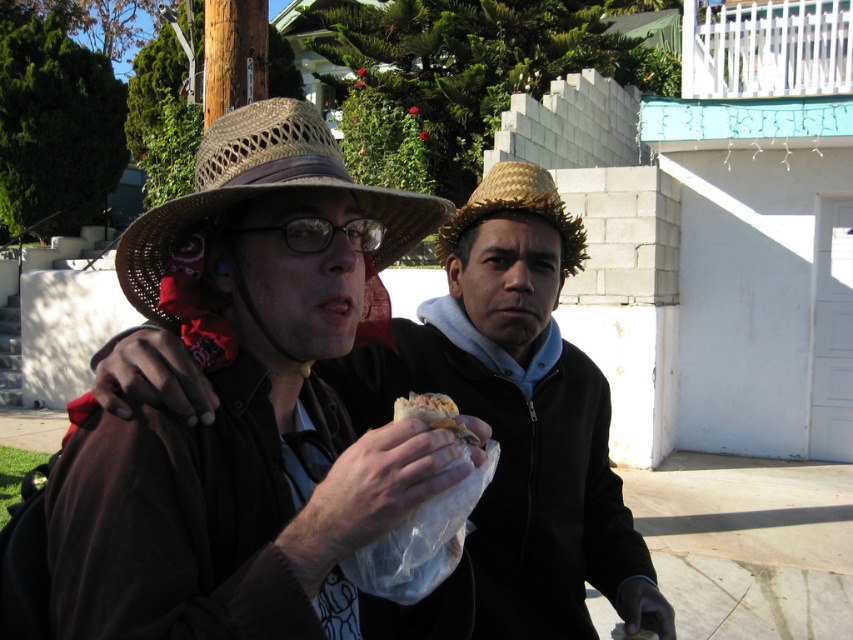
Question: Is woven straw hat at center positioned in front of shiny plastic wrap at center?

Choices:
 (A) no
 (B) yes

Answer: (A)

Question: Which object is farther from the camera taking this photo?

Choices:
 (A) strawmaterial/texturehat at center
 (B) shiny plastic wrap at center
 (C) woven straw hat at center
 (D) matte brown hat at center

Answer: (A)

Question: Which object appears farthest from the camera in this image?

Choices:
 (A) matte brown hat at center
 (B) strawmaterial/texturehat at center

Answer: (B)

Question: Which object appears farthest from the camera in this image?

Choices:
 (A) woven straw hat at center
 (B) shiny plastic wrap at center
 (C) matte brown hat at center
 (D) strawmaterial/texturehat at center

Answer: (D)

Question: Can you confirm if matte brown hat at center is bigger than woven straw hat at center?

Choices:
 (A) yes
 (B) no

Answer: (A)

Question: Can you confirm if matte brown hat at center is positioned above woven straw hat at center?

Choices:
 (A) no
 (B) yes

Answer: (A)